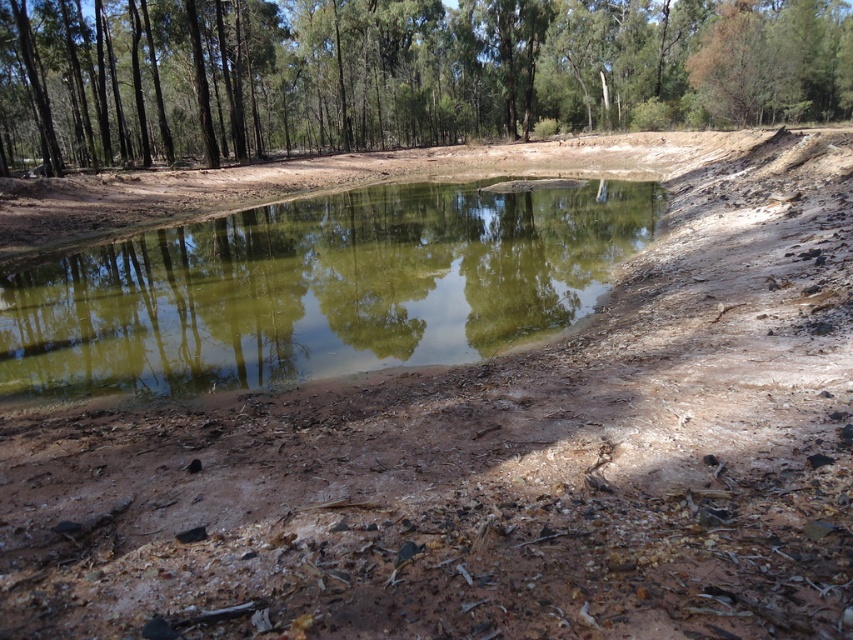
Is point (164, 141) closer to camera compared to point (334, 314)?

No, it is not.

Who is lower down, green leafy tree at upper center or green reflective water at center?

Positioned lower is green reflective water at center.

This screenshot has width=853, height=640. Find the location of `green leafy tree at upper center`. green leafy tree at upper center is located at coordinates (399, 74).